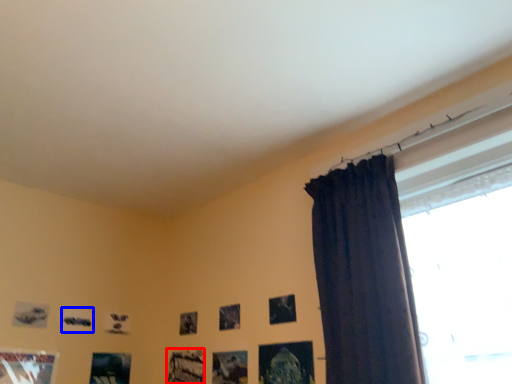
Question: Which point is closer to the camera, picture frame (highlighted by a red box) or picture frame (highlighted by a blue box)?

Choices:
 (A) picture frame
 (B) picture frame

Answer: (A)